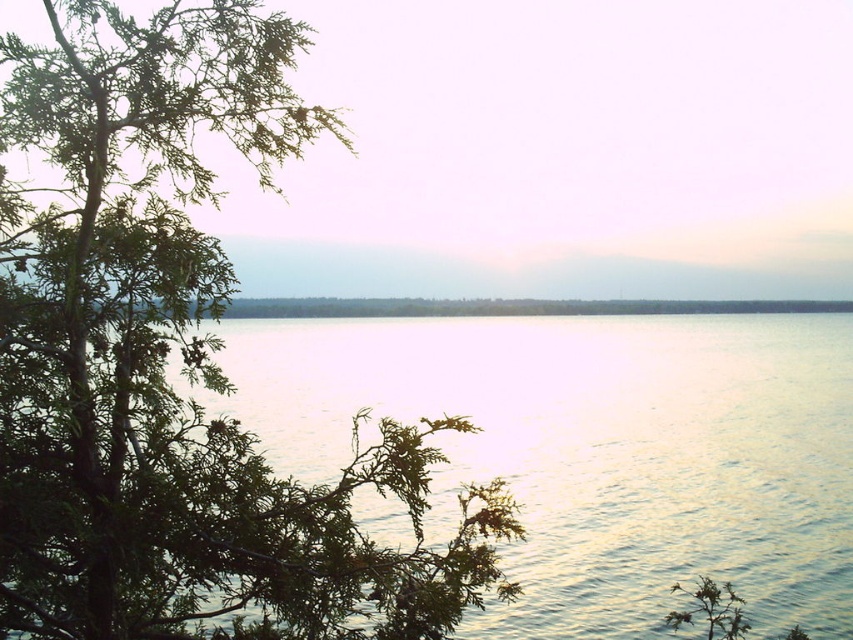
Question: Is green textured leaves at left further to the viewer compared to glistening silver water at center?

Choices:
 (A) yes
 (B) no

Answer: (B)

Question: Which object appears farthest from the camera in this image?

Choices:
 (A) glistening silver water at center
 (B) green textured leaves at left

Answer: (A)

Question: Is green textured leaves at left wider than glistening silver water at center?

Choices:
 (A) no
 (B) yes

Answer: (A)

Question: Can you confirm if green textured leaves at left is thinner than glistening silver water at center?

Choices:
 (A) no
 (B) yes

Answer: (B)

Question: Which of the following is the closest to the observer?

Choices:
 (A) (78, 456)
 (B) (734, 493)

Answer: (A)